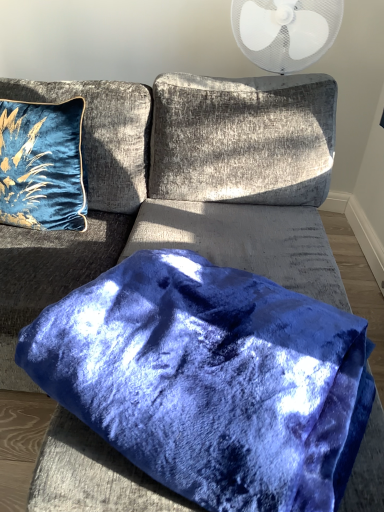
Question: Considering the relative sizes of velvet blue couch at center and velvet blue pillow at upper left, arranged as the 1th pillow when viewed from the left, in the image provided, is velvet blue couch at center shorter than velvet blue pillow at upper left, arranged as the 1th pillow when viewed from the left,?

Choices:
 (A) yes
 (B) no

Answer: (B)

Question: Is velvet blue couch at center beside velvet blue pillow at upper left, the 2th pillow from the front?

Choices:
 (A) yes
 (B) no

Answer: (B)

Question: Does velvet blue couch at center have a smaller size compared to velvet blue pillow at upper left, which appears as the second pillow when ordered from the bottom?

Choices:
 (A) yes
 (B) no

Answer: (B)

Question: Considering the relative sizes of velvet blue couch at center and velvet blue pillow at upper left, the second pillow viewed from the right, in the image provided, is velvet blue couch at center wider than velvet blue pillow at upper left, the second pillow viewed from the right,?

Choices:
 (A) yes
 (B) no

Answer: (A)

Question: Is velvet blue couch at center not near velvet blue pillow at upper left, which appears as the first pillow when viewed from the back?

Choices:
 (A) no
 (B) yes

Answer: (A)

Question: Could you tell me if velvet blue couch at center is facing velvet blue pillow at upper left, arranged as the 1th pillow when viewed from the left?

Choices:
 (A) no
 (B) yes

Answer: (A)

Question: From the image's perspective, would you say velvet blue pillow at center, the second pillow from the back, is shown under velvet blue pillow at upper left, which appears as the first pillow when viewed from the back?

Choices:
 (A) yes
 (B) no

Answer: (A)

Question: Is velvet blue pillow at center, the second pillow from the back, in contact with velvet blue pillow at upper left, the 2th pillow from the front?

Choices:
 (A) yes
 (B) no

Answer: (B)

Question: Is velvet blue pillow at center, the first pillow from the front, shorter than velvet blue pillow at upper left, the second pillow viewed from the right?

Choices:
 (A) yes
 (B) no

Answer: (A)

Question: Is the position of velvet blue pillow at center, arranged as the first pillow when viewed from the right, less distant than that of velvet blue pillow at upper left, acting as the first pillow starting from the top?

Choices:
 (A) yes
 (B) no

Answer: (A)

Question: Are velvet blue pillow at center, arranged as the first pillow when viewed from the right, and velvet blue pillow at upper left, the 2th pillow from the front, located far from each other?

Choices:
 (A) no
 (B) yes

Answer: (A)

Question: From the image's perspective, does velvet blue pillow at center, acting as the second pillow starting from the left, appear higher than velvet blue pillow at upper left, which appears as the second pillow when ordered from the bottom?

Choices:
 (A) yes
 (B) no

Answer: (B)

Question: Is velvet blue pillow at upper left, the second pillow viewed from the right, bigger than velvet blue pillow at center, the first pillow from the front?

Choices:
 (A) no
 (B) yes

Answer: (A)